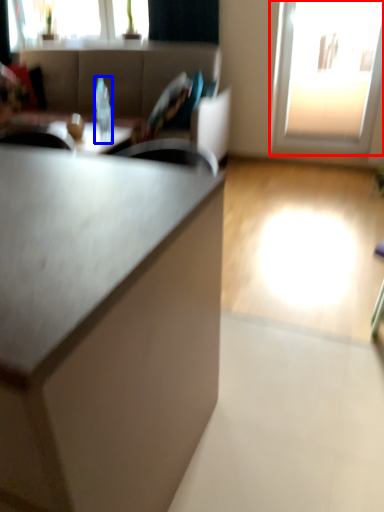
Question: Which object appears farthest to the camera in this image, window (highlighted by a red box) or bottle (highlighted by a blue box)?

Choices:
 (A) window
 (B) bottle

Answer: (A)